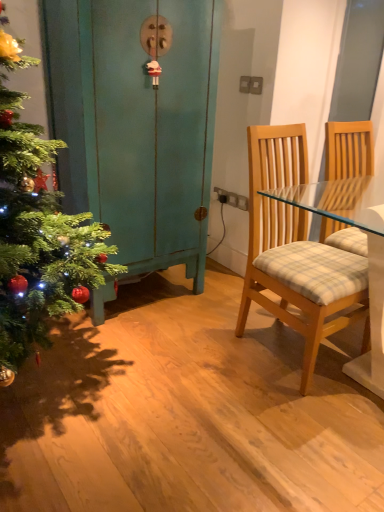
Where is `vacant region in front of light wood/glass chair at right`? The width and height of the screenshot is (384, 512). vacant region in front of light wood/glass chair at right is located at coordinates tap(296, 418).